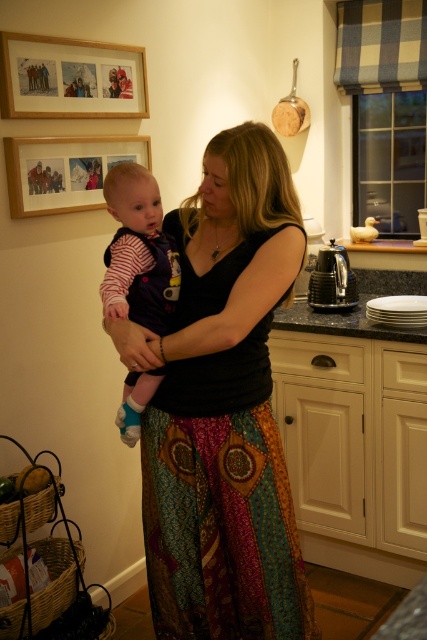
Question: Which point is farther from the camera taking this photo?

Choices:
 (A) (90, 70)
 (B) (132, 426)
 (C) (29, 196)

Answer: (A)

Question: In this image, where is black matte tank top at center located relative to striped cotton onesie at center?

Choices:
 (A) left
 (B) right

Answer: (B)

Question: Which point is farther from the camera taking this photo?

Choices:
 (A) (236, 340)
 (B) (119, 426)
 (C) (11, 173)

Answer: (C)

Question: Among these objects, which one is farthest from the camera?

Choices:
 (A) wooden picture frame at upper left
 (B) striped cotton onesie at center

Answer: (A)

Question: Is black matte tank top at center positioned behind wooden picture frame at upper left?

Choices:
 (A) no
 (B) yes

Answer: (A)

Question: Where is black matte tank top at center located in relation to wooden framed picture at upper left in the image?

Choices:
 (A) left
 (B) right

Answer: (B)